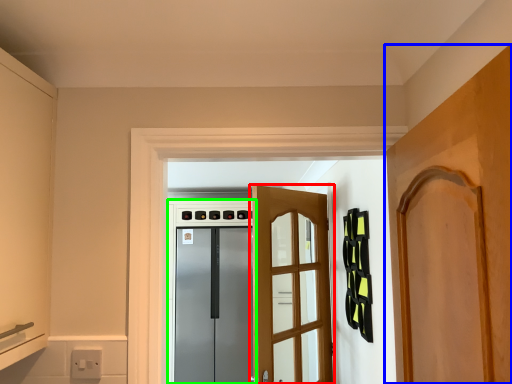
Question: Estimate the real-world distances between objects in this image. Which object is closer to door (highlighted by a red box), door (highlighted by a blue box) or appliance (highlighted by a green box)?

Choices:
 (A) door
 (B) appliance

Answer: (A)